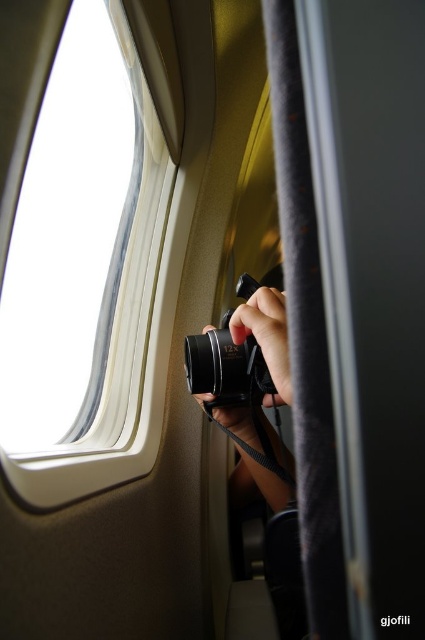
Who is more forward, (x=136, y=314) or (x=274, y=401)?

Point (x=274, y=401)

Is point (121, 285) positioned in front of point (288, 388)?

That is False.

The width and height of the screenshot is (425, 640). What do you see at coordinates (118, 356) in the screenshot?
I see `white plastic airplane window at upper left` at bounding box center [118, 356].

At what (x,y) coordinates should I click in order to perform the action: click on white plastic airplane window at upper left. Please return your answer as a coordinate pair (x, y). Looking at the image, I should click on (118, 356).